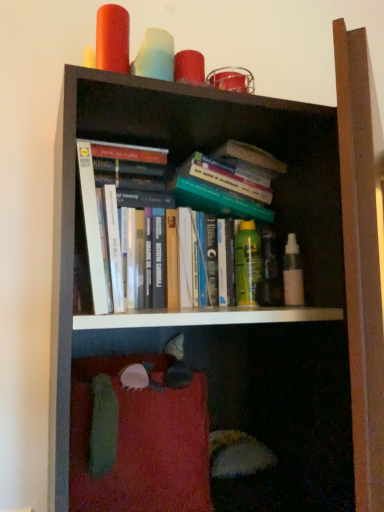
Question: From a real-world perspective, does white matte spray bottle at center right, acting as the 1th toiletry starting from the right, stand above white paperbacks at center?

Choices:
 (A) no
 (B) yes

Answer: (A)

Question: Is white matte spray bottle at center right, positioned as the 1th toiletry in front-to-back order, further to the viewer compared to white paperbacks at center?

Choices:
 (A) yes
 (B) no

Answer: (A)

Question: Considering the relative sizes of white matte spray bottle at center right, positioned as the 1th toiletry in front-to-back order, and white paperbacks at center in the image provided, is white matte spray bottle at center right, positioned as the 1th toiletry in front-to-back order, taller than white paperbacks at center?

Choices:
 (A) no
 (B) yes

Answer: (A)

Question: Can you confirm if white matte spray bottle at center right, acting as the 1th toiletry starting from the right, is wider than white paperbacks at center?

Choices:
 (A) no
 (B) yes

Answer: (A)

Question: Is white matte spray bottle at center right, arranged as the 2th toiletry when viewed from the left, looking in the opposite direction of white paperbacks at center?

Choices:
 (A) no
 (B) yes

Answer: (A)

Question: Does point (292, 267) appear closer or farther from the camera than point (119, 179)?

Choices:
 (A) closer
 (B) farther

Answer: (B)

Question: Relative to white paperbacks at center, is white matte spray bottle at center right, acting as the 1th toiletry starting from the right, in front or behind?

Choices:
 (A) front
 (B) behind

Answer: (B)

Question: Looking at the image, does white matte spray bottle at center right, arranged as the 2th toiletry when viewed from the left, seem bigger or smaller compared to white paperbacks at center?

Choices:
 (A) big
 (B) small

Answer: (B)

Question: Is white matte spray bottle at center right, positioned as the 1th toiletry in front-to-back order, inside the boundaries of white paperbacks at center, or outside?

Choices:
 (A) outside
 (B) inside

Answer: (A)

Question: Does point (142, 274) appear closer or farther from the camera than point (251, 278)?

Choices:
 (A) farther
 (B) closer

Answer: (B)

Question: From a real-world perspective, is white paperbacks at center physically located above or below green matte spray can at center, arranged as the first toiletry when viewed from the back?

Choices:
 (A) above
 (B) below

Answer: (A)

Question: In terms of width, does white paperbacks at center look wider or thinner when compared to green matte spray can at center, arranged as the first toiletry when viewed from the back?

Choices:
 (A) wide
 (B) thin

Answer: (A)

Question: From the image's perspective, is white paperbacks at center positioned above or below green matte spray can at center, which is the first toiletry in left-to-right order?

Choices:
 (A) above
 (B) below

Answer: (A)

Question: In the image, is green matte spray can at center, which is the first toiletry in left-to-right order, positioned in front of or behind white paperbacks at center?

Choices:
 (A) behind
 (B) front

Answer: (A)

Question: Does point coord(236,242) appear closer or farther from the camera than point coord(130,154)?

Choices:
 (A) closer
 (B) farther

Answer: (B)